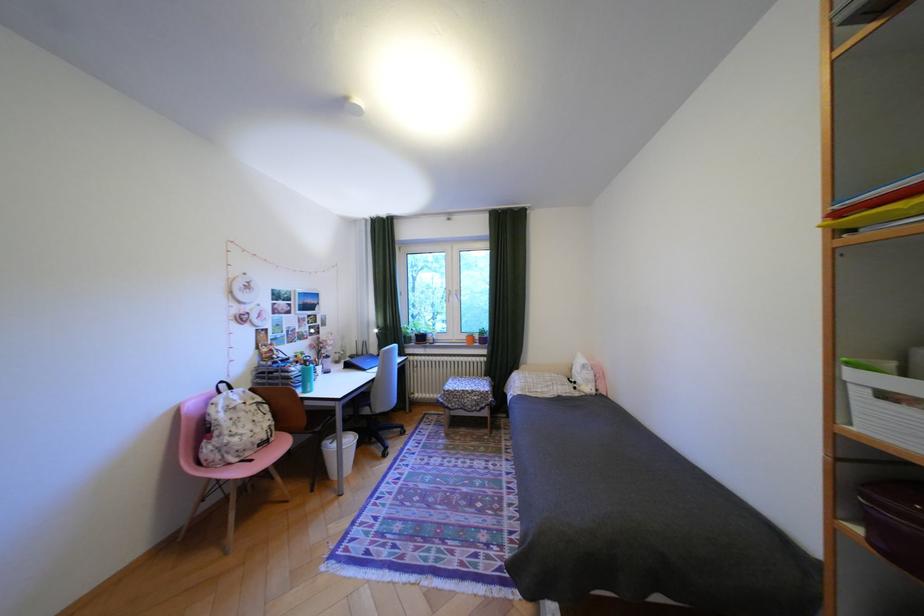
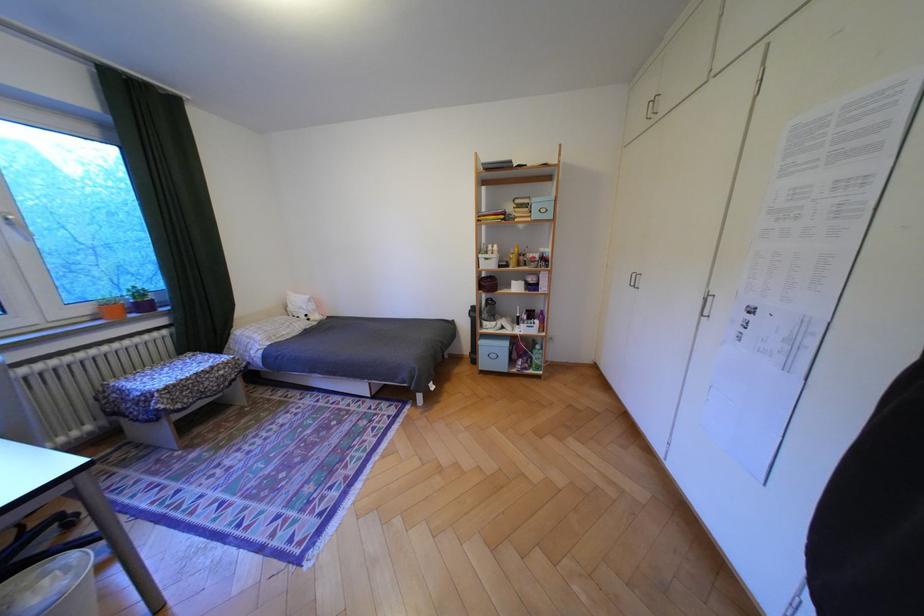
In the second image, find the point that corresponds to the point at 494,341 in the first image.

(155, 307)